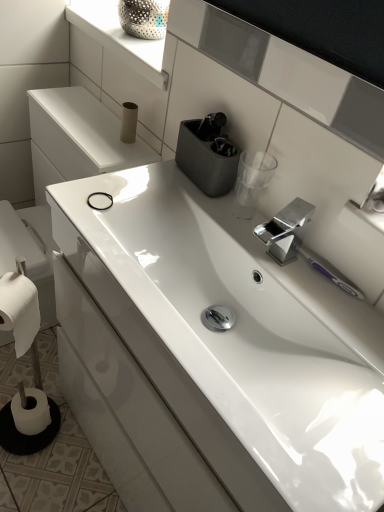
The height and width of the screenshot is (512, 384). I want to click on vacant space that is to the left of polished metallic tap at center, so click(207, 221).